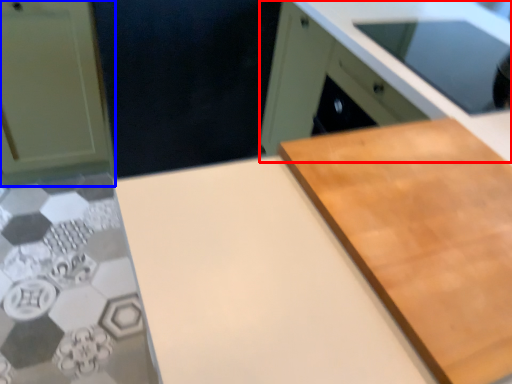
Question: Among these objects, which one is nearest to the camera, cabinetry (highlighted by a red box) or cabinetry (highlighted by a blue box)?

Choices:
 (A) cabinetry
 (B) cabinetry

Answer: (A)